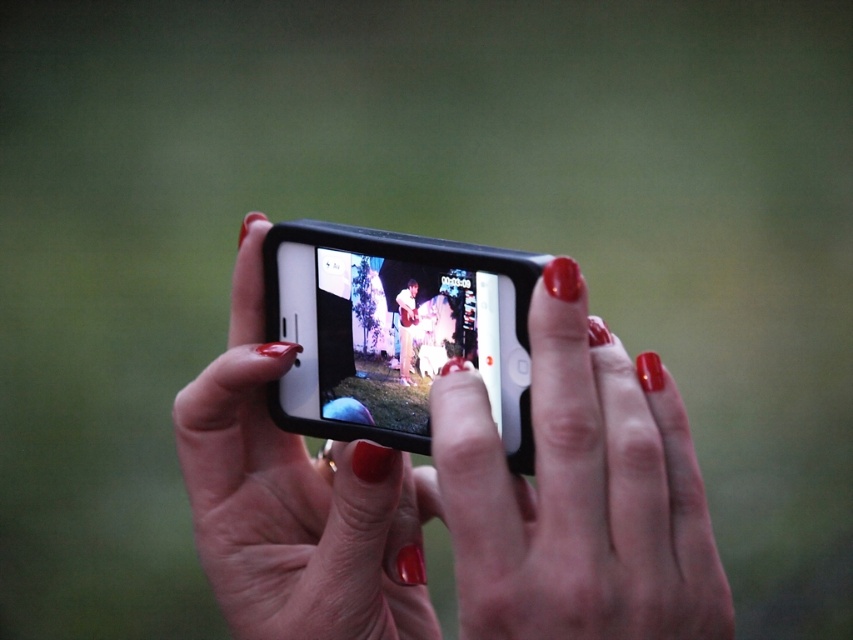
Can you confirm if matte black phone at center is shorter than black matte smartphone at center?

In fact, matte black phone at center may be taller than black matte smartphone at center.

Does point (357, 481) lie in front of point (462, 278)?

No, (357, 481) is behind (462, 278).

In order to click on matte black phone at center in this screenshot , I will do `click(296, 499)`.

Between point (268, 529) and point (398, 320), which one is positioned behind?

Positioned behind is point (268, 529).

Does point (250, 339) come closer to viewer compared to point (405, 380)?

That is False.

Where is `matte black phone at center`? This screenshot has width=853, height=640. matte black phone at center is located at coordinates (296, 499).

Does point (587, 440) lie in front of point (302, 225)?

That is True.

Does glossy red nail polish at center have a lesser height compared to black matte smartphone at center?

Incorrect, glossy red nail polish at center's height does not fall short of black matte smartphone at center's.

Measure the distance between point [582,598] and camera.

A distance of 46.36 centimeters exists between point [582,598] and camera.

Find the location of a particular element. This screenshot has height=640, width=853. glossy red nail polish at center is located at coordinates (573, 492).